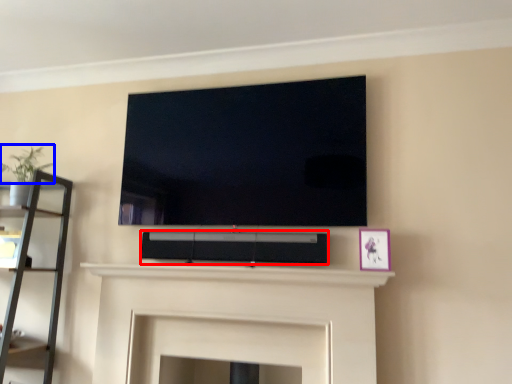
Question: Which object appears farthest to the camera in this image, speaker (highlighted by a red box) or plant (highlighted by a blue box)?

Choices:
 (A) speaker
 (B) plant

Answer: (B)